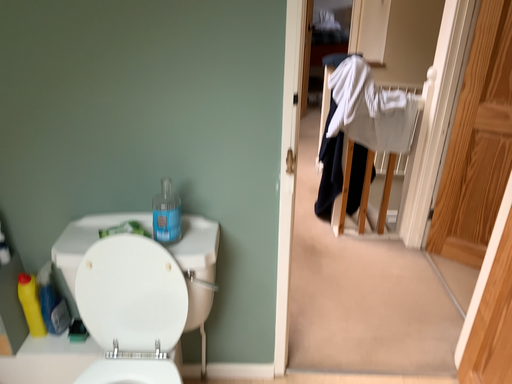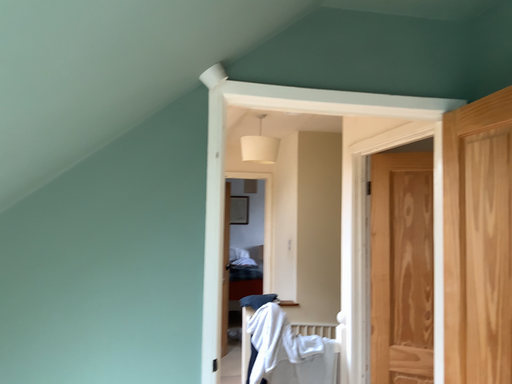
Question: Which way did the camera rotate in the video?

Choices:
 (A) rotated downward
 (B) rotated upward

Answer: (B)